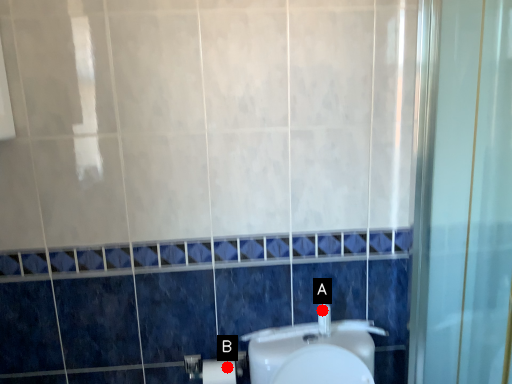
Question: Two points are circled on the image, labeled by A and B beside each circle. Which of the following is the closest to the observer?

Choices:
 (A) A is closer
 (B) B is closer

Answer: (B)